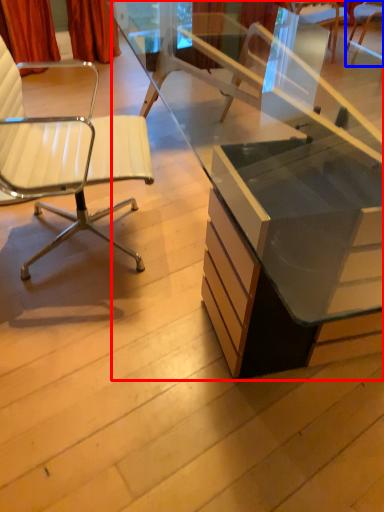
Question: Which object appears closest to the camera in this image, desk (highlighted by a red box) or chair (highlighted by a blue box)?

Choices:
 (A) desk
 (B) chair

Answer: (A)